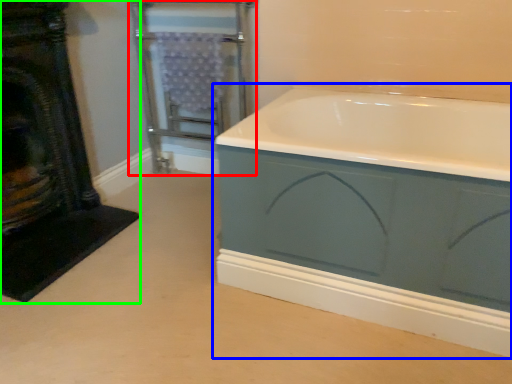
Question: Which object is the closest to the screen door (highlighted by a red box)? Choose among these: bathtub (highlighted by a blue box) or fireplace (highlighted by a green box).

Choices:
 (A) bathtub
 (B) fireplace

Answer: (B)